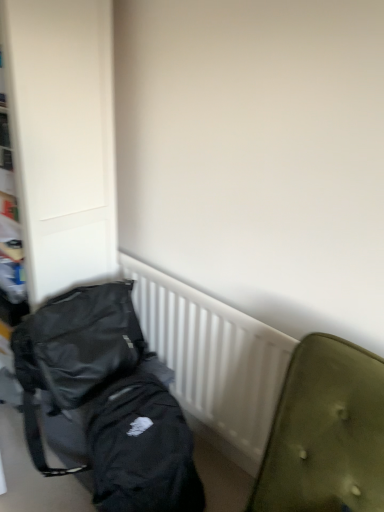
Question: Is black fabric backpack at left not close to black matte backpack at lower left?

Choices:
 (A) no
 (B) yes

Answer: (A)

Question: Considering the relative sizes of black fabric backpack at left and black matte backpack at lower left in the image provided, is black fabric backpack at left bigger than black matte backpack at lower left?

Choices:
 (A) no
 (B) yes

Answer: (B)

Question: Would you say black matte backpack at lower left is part of black fabric backpack at left's contents?

Choices:
 (A) yes
 (B) no

Answer: (B)

Question: Is black fabric backpack at left with black matte backpack at lower left?

Choices:
 (A) yes
 (B) no

Answer: (B)

Question: Is black fabric backpack at left looking in the opposite direction of black matte backpack at lower left?

Choices:
 (A) no
 (B) yes

Answer: (A)

Question: Does black fabric backpack at left lie in front of black matte backpack at lower left?

Choices:
 (A) no
 (B) yes

Answer: (B)

Question: From a real-world perspective, is black matte backpack at lower left below white plastic radiator at center?

Choices:
 (A) yes
 (B) no

Answer: (B)

Question: Can you confirm if black matte backpack at lower left is thinner than white plastic radiator at center?

Choices:
 (A) yes
 (B) no

Answer: (B)

Question: Is black matte backpack at lower left behind white plastic radiator at center?

Choices:
 (A) yes
 (B) no

Answer: (B)

Question: From the image's perspective, would you say black matte backpack at lower left is positioned over white plastic radiator at center?

Choices:
 (A) no
 (B) yes

Answer: (B)

Question: Can you confirm if black matte backpack at lower left is taller than white plastic radiator at center?

Choices:
 (A) yes
 (B) no

Answer: (B)

Question: From the image's perspective, is black matte backpack at lower left located beneath white plastic radiator at center?

Choices:
 (A) yes
 (B) no

Answer: (B)

Question: Is black fabric backpack at left bigger than white plastic radiator at center?

Choices:
 (A) no
 (B) yes

Answer: (B)